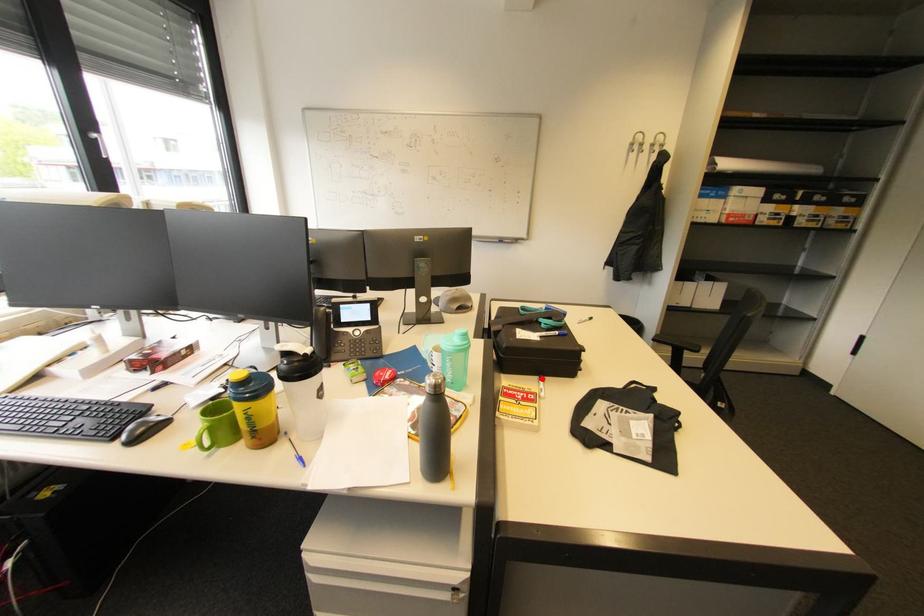
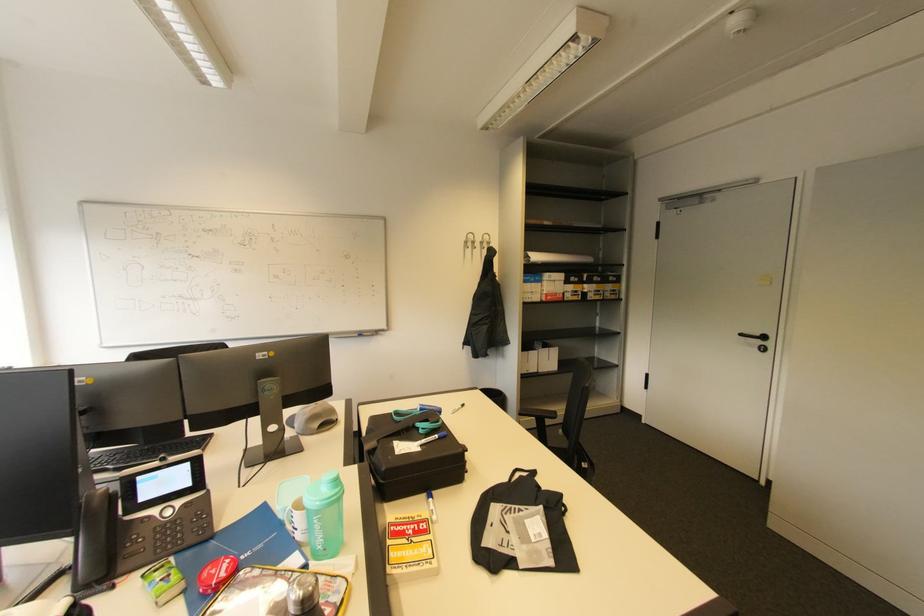
Question: I am providing you with two images of the same scene from different viewpoints. Given a red point in image1, look at the same physical point in image2. Is it:

Choices:
 (A) Closer to the viewpoint
 (B) Farther from the viewpoint

Answer: (B)